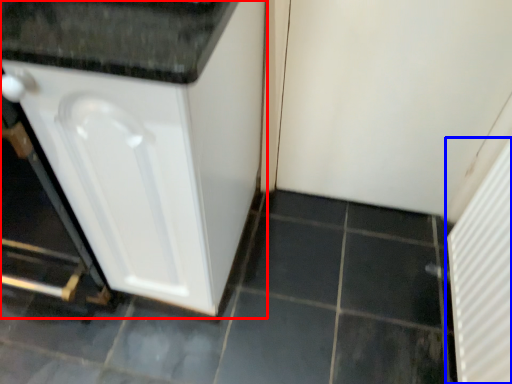
Question: Among these objects, which one is farthest to the camera, cabinetry (highlighted by a red box) or screen door (highlighted by a blue box)?

Choices:
 (A) cabinetry
 (B) screen door

Answer: (B)